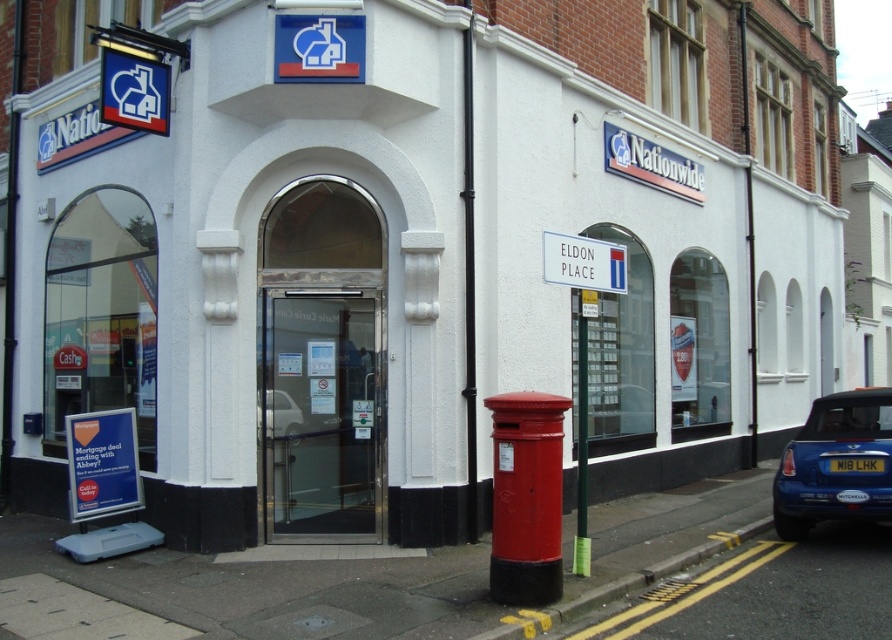
Who is lower down, transparent glass door at center or white plastic license plate at lower right?

white plastic license plate at lower right is lower down.

Does transparent glass door at center come behind white plastic license plate at lower right?

Yes, transparent glass door at center is further from the viewer.

Locate an element on the screen. transparent glass door at center is located at coordinates (321, 412).

Where is `transparent glass door at center`? This screenshot has width=892, height=640. transparent glass door at center is located at coordinates (321, 412).

Is blue metallic car at lower right smaller than metallic green pole at center?

No, blue metallic car at lower right is not smaller than metallic green pole at center.

Who is more forward, (816,458) or (589,566)?

Point (589,566) is more forward.

Identify the location of blue metallic car at lower right. (x=836, y=464).

Can you confirm if metallic green pole at center is shorter than white plastic license plate at lower right?

No.

Which is more to the right, metallic green pole at center or white plastic license plate at lower right?

From the viewer's perspective, white plastic license plate at lower right appears more on the right side.

Between point (582, 490) and point (877, 467), which one is positioned behind?

The point (877, 467) is more distant.

Where is `metallic green pole at center`? The height and width of the screenshot is (640, 892). metallic green pole at center is located at coordinates (581, 445).